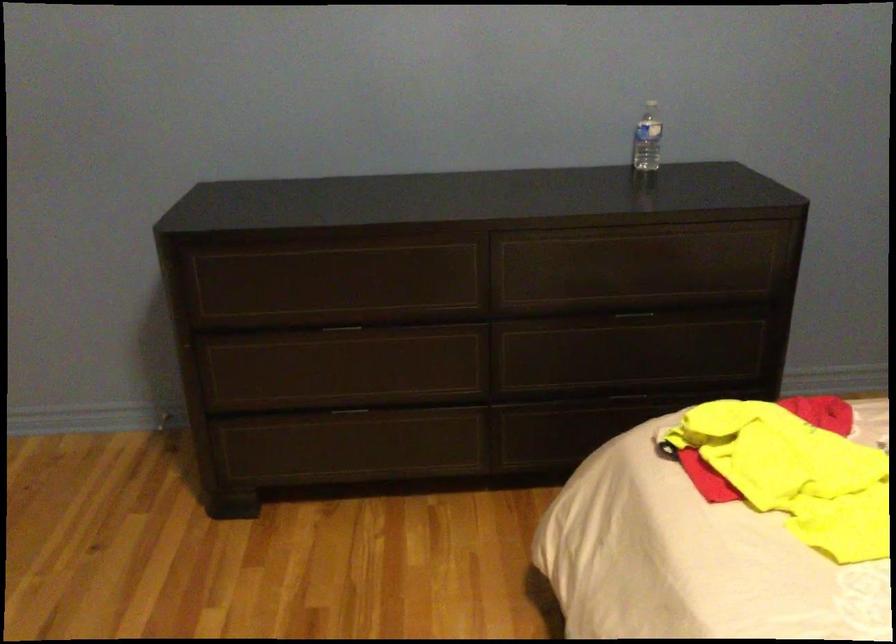
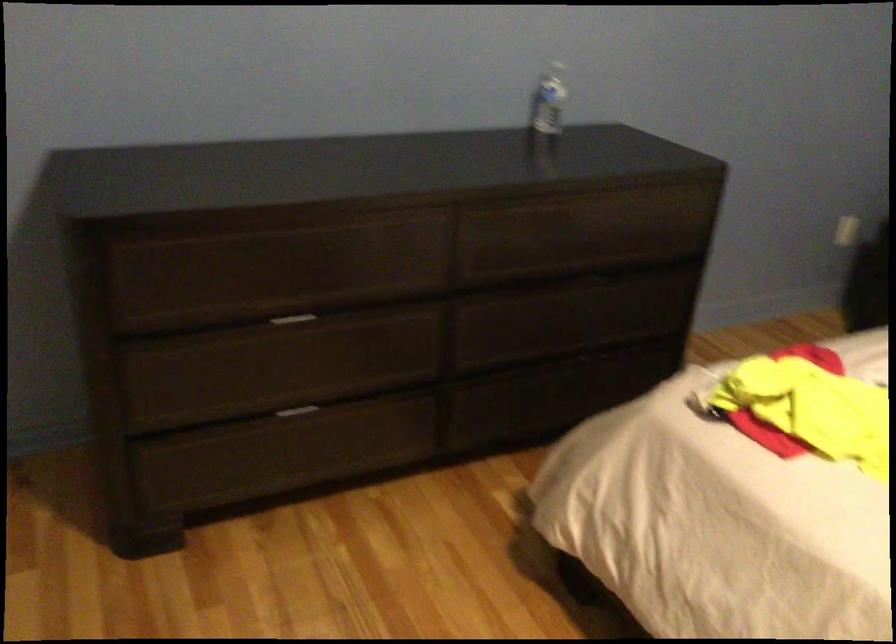
Locate, in the second image, the point that corresponds to pixel 349 412 in the first image.

(297, 411)